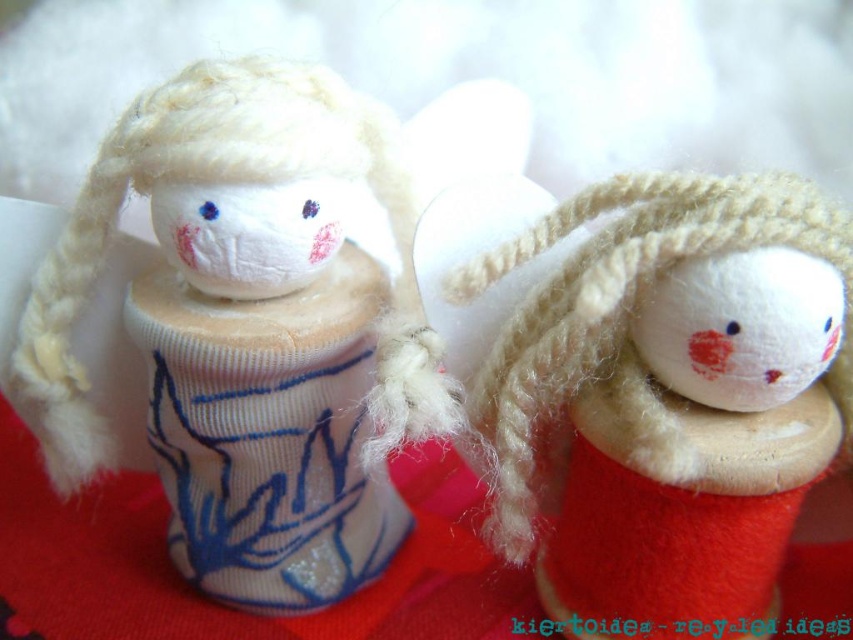
You are an artist arranging two dolls on a display stand. You have the white felt snowman at center and the red felt doll at center. According to the image, which doll is placed higher up on the stand?

The white felt snowman at center is positioned over the red felt doll at center, so it is placed higher up on the stand.

You are taking a photo of two points in the image. The first point is at coordinate point (184, 467) and the second is at point (683, 531). Which point will appear closer to the camera in the photo?

Point (184, 467) is further to the camera than point (683, 531), so the first point will appear closer to the camera in the photo.

You are an artist planning to display the white felt snowman at center and the red felt doll at center on a shelf. Based on their sizes, which one should you place first to ensure stability?

The white felt snowman at center is taller than the red felt doll at center, so you should place the white felt snowman at center first to ensure stability.